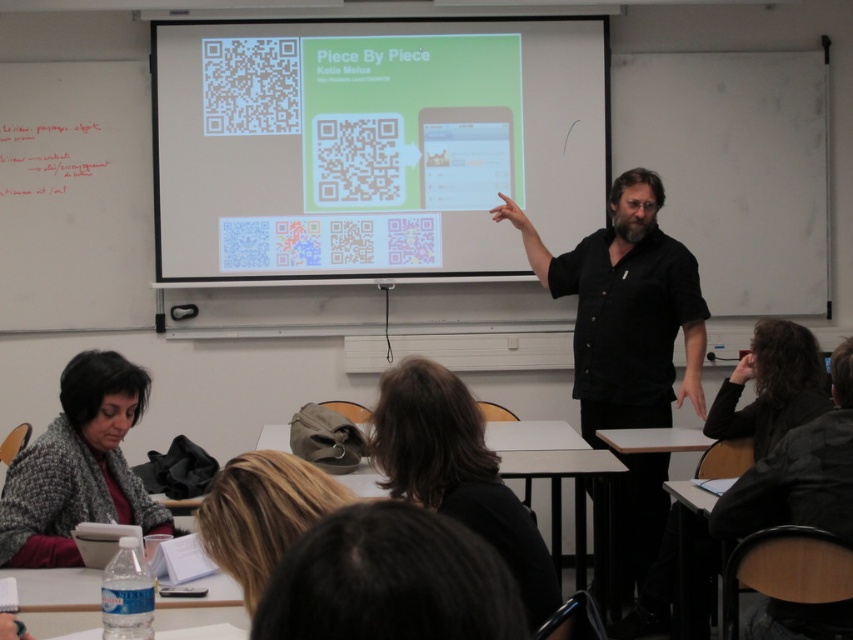
Is black matte shirt at center wider than knitted gray sweater at lower left?

Correct, the width of black matte shirt at center exceeds that of knitted gray sweater at lower left.

Does black matte shirt at center appear over knitted gray sweater at lower left?

Yes, black matte shirt at center is above knitted gray sweater at lower left.

Which is behind, point (637, 356) or point (62, 563)?

The point (637, 356) is more distant.

Where is `black matte shirt at center`? This screenshot has width=853, height=640. black matte shirt at center is located at coordinates (625, 308).

Does white matte qr code at upper center have a larger size compared to black matte shirt at center?

No, white matte qr code at upper center is not bigger than black matte shirt at center.

Is white matte qr code at upper center taller than black matte shirt at center?

No, white matte qr code at upper center is not taller than black matte shirt at center.

The height and width of the screenshot is (640, 853). Describe the element at coordinates (372, 145) in the screenshot. I see `white matte qr code at upper center` at that location.

The image size is (853, 640). In order to click on white matte qr code at upper center in this screenshot , I will do `click(372, 145)`.

Does white matte qr code at upper center have a lesser height compared to knitted gray sweater at lower left?

Incorrect, white matte qr code at upper center's height does not fall short of knitted gray sweater at lower left's.

Does white matte qr code at upper center appear on the left side of knitted gray sweater at lower left?

Incorrect, white matte qr code at upper center is not on the left side of knitted gray sweater at lower left.

Is point (260, 252) less distant than point (129, 516)?

That is False.

Find the location of a particular element. The image size is (853, 640). white matte qr code at upper center is located at coordinates (372, 145).